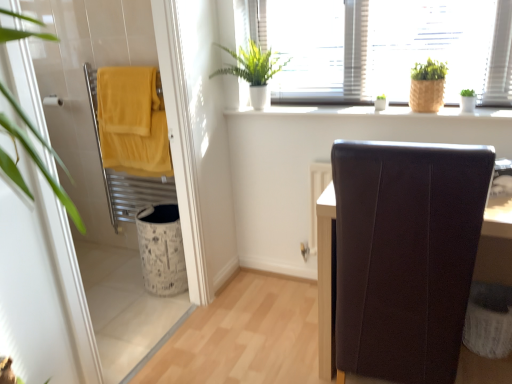
Question: Is white textured laundry basket at lower right looking in the opposite direction of green matte plant at upper right, the 1th houseplant positioned from the right?

Choices:
 (A) yes
 (B) no

Answer: (B)

Question: Is white textured laundry basket at lower right beside green matte plant at upper right, which is the 3th houseplant in left-to-right order?

Choices:
 (A) no
 (B) yes

Answer: (A)

Question: Does white textured laundry basket at lower right lie in front of green matte plant at upper right, the 1th houseplant positioned from the right?

Choices:
 (A) yes
 (B) no

Answer: (A)

Question: Is white textured laundry basket at lower right at the right side of green matte plant at upper right, which is the 3th houseplant in left-to-right order?

Choices:
 (A) no
 (B) yes

Answer: (B)

Question: Can you confirm if white textured laundry basket at lower right is positioned to the left of green matte plant at upper right, which is the 3th houseplant in left-to-right order?

Choices:
 (A) no
 (B) yes

Answer: (A)

Question: Is white textured laundry basket at lower right outside of green matte plant at upper right, which is the 3th houseplant in left-to-right order?

Choices:
 (A) yes
 (B) no

Answer: (A)

Question: From the image's perspective, is white textured laundry basket at lower right located beneath bamboo textured pot at upper right, the second houseplant viewed from the left?

Choices:
 (A) no
 (B) yes

Answer: (B)

Question: Considering the relative positions of white textured laundry basket at lower right and bamboo textured pot at upper right, the second houseplant viewed from the left, in the image provided, is white textured laundry basket at lower right behind bamboo textured pot at upper right, the second houseplant viewed from the left,?

Choices:
 (A) yes
 (B) no

Answer: (B)

Question: Is white textured laundry basket at lower right next to bamboo textured pot at upper right, acting as the second houseplant starting from the right, and touching it?

Choices:
 (A) no
 (B) yes

Answer: (A)

Question: Is white textured laundry basket at lower right not near bamboo textured pot at upper right, the second houseplant viewed from the left?

Choices:
 (A) no
 (B) yes

Answer: (A)

Question: Does white textured laundry basket at lower right come in front of bamboo textured pot at upper right, the second houseplant viewed from the left?

Choices:
 (A) no
 (B) yes

Answer: (B)

Question: Can you confirm if white textured laundry basket at lower right is shorter than bamboo textured pot at upper right, the second houseplant viewed from the left?

Choices:
 (A) yes
 (B) no

Answer: (B)

Question: Considering the relative positions of white textured laundry basket at lower right and brown leather chair at right in the image provided, is white textured laundry basket at lower right to the left of brown leather chair at right from the viewer's perspective?

Choices:
 (A) yes
 (B) no

Answer: (B)